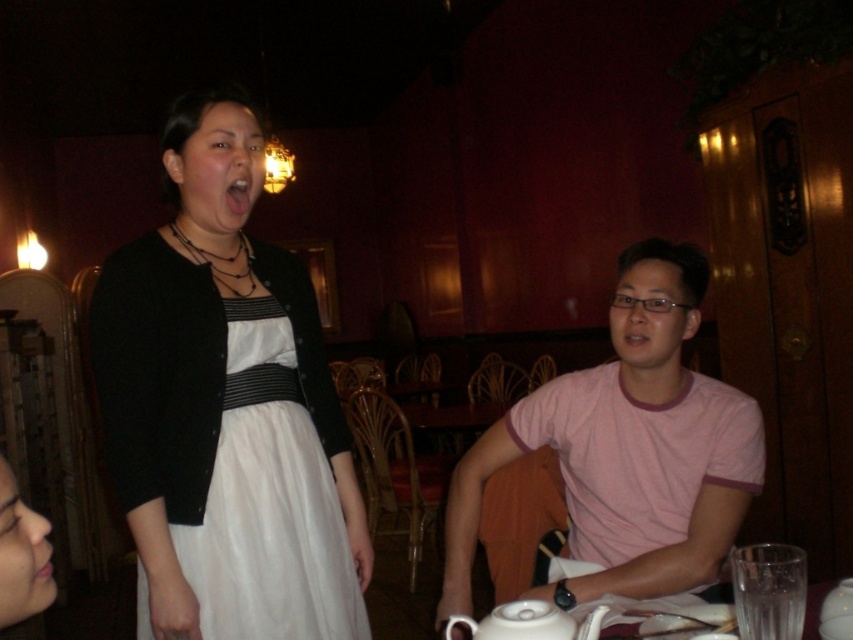
Question: Does pink cotton shirt at right appear over pink glossy lips at center?

Choices:
 (A) yes
 (B) no

Answer: (B)

Question: Is pink cotton shirt at right smaller than pink matte flesh at lower left?

Choices:
 (A) yes
 (B) no

Answer: (B)

Question: Which object is closer to the camera taking this photo?

Choices:
 (A) pink cotton shirt at right
 (B) white glossy teapot at lower center
 (C) pink matte flesh at lower left
 (D) pink glossy lips at center

Answer: (C)

Question: Which of the following is the farthest from the observer?

Choices:
 (A) pink matte flesh at lower left
 (B) white glossy teapot at lower center
 (C) pink glossy lips at center

Answer: (C)

Question: Which point appears farthest from the camera in this image?

Choices:
 (A) (743, 438)
 (B) (49, 552)
 (C) (303, 516)
 (D) (514, 618)

Answer: (A)

Question: Is pink glossy lips at center above pink matte flesh at lower left?

Choices:
 (A) no
 (B) yes

Answer: (B)